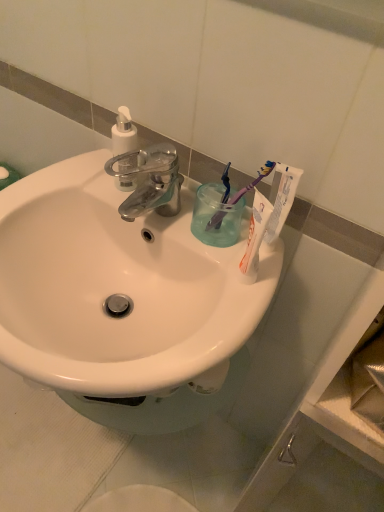
This screenshot has height=512, width=384. Find the location of `vacant space to the left of white matte toothpaste at upper right`. vacant space to the left of white matte toothpaste at upper right is located at coordinates (195, 227).